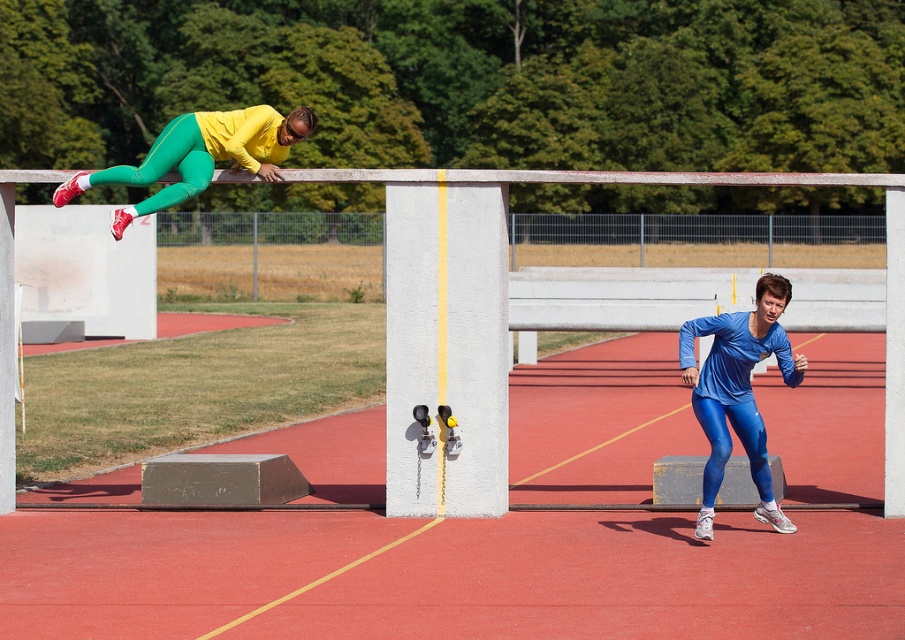
Consider the image. You are a photographer standing at the edge of the red track. You need to capture a photo that includes both the white concrete pillar at center and the blue shiny leggings at lower right. Considering their sizes, which object should you place closer to the camera to ensure both are visible in the frame?

Since the white concrete pillar at center is smaller than the blue shiny leggings at lower right, you should place the white concrete pillar at center closer to the camera to ensure both objects are visible in the frame.

You are an athlete preparing to sprint around the track. You notice the white concrete pillar at center and the matte yellow and green athletic suit at upper left. Which object is larger in size?

The white concrete pillar at center is bigger than the matte yellow and green athletic suit at upper left, so the pillar is larger.

You are a photographer positioned at the center of the track. You need to capture a photo where both the blue shiny leggings at lower right and the matte yellow and green athletic suit at upper left are visible. Considering their heights, which athlete should you focus on to ensure both are in frame without adjusting your camera angle?

The blue shiny leggings at lower right has a greater height compared to matte yellow and green athletic suit at upper left. To ensure both are visible without adjusting the camera angle, focus on the taller athlete, the blue shiny leggings at lower right, as their height might help keep the shorter athlete in frame.